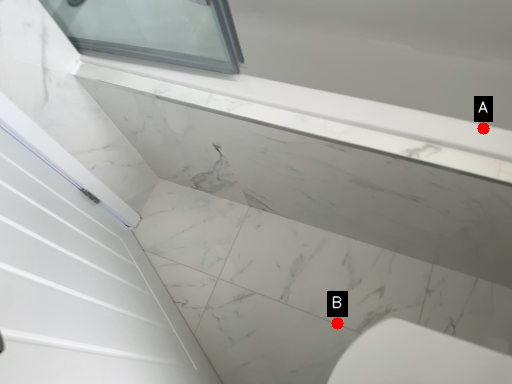
Question: Two points are circled on the image, labeled by A and B beside each circle. Which point is farther to the camera?

Choices:
 (A) A is further
 (B) B is further

Answer: (B)